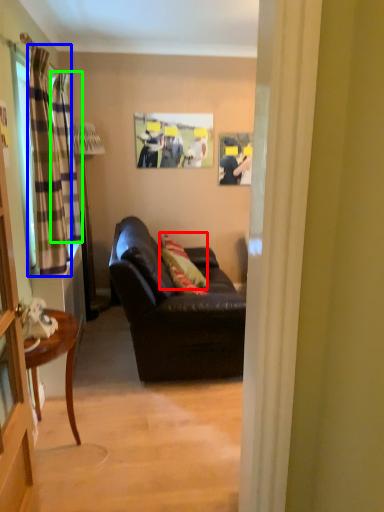
Question: Considering the real-world distances, which object is farthest from pillow (highlighted by a red box)? curtain (highlighted by a blue box) or curtain (highlighted by a green box)?

Choices:
 (A) curtain
 (B) curtain

Answer: (A)